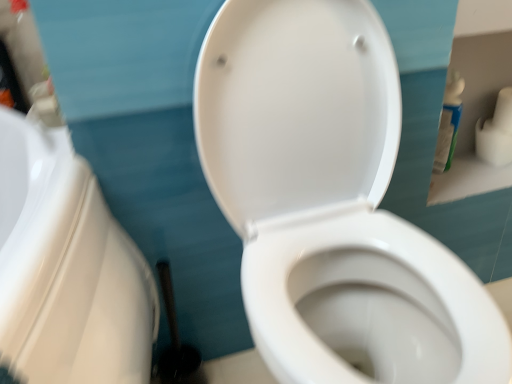
Question: Would you say white plastic bottle at upper right is a long distance from white glossy toilet at center?

Choices:
 (A) yes
 (B) no

Answer: (B)

Question: Does white plastic bottle at upper right have a lesser width compared to white glossy toilet at center?

Choices:
 (A) no
 (B) yes

Answer: (B)

Question: Is white plastic bottle at upper right at the left side of white glossy toilet at center?

Choices:
 (A) no
 (B) yes

Answer: (A)

Question: Is white plastic bottle at upper right oriented away from white glossy toilet at center?

Choices:
 (A) no
 (B) yes

Answer: (A)

Question: Are white plastic bottle at upper right and white glossy toilet at center making contact?

Choices:
 (A) yes
 (B) no

Answer: (B)

Question: Based on their sizes in the image, would you say white glossy toilet at center is bigger or smaller than white matte toilet paper at upper right?

Choices:
 (A) big
 (B) small

Answer: (A)

Question: From a real-world perspective, is white glossy toilet at center positioned above or below white matte toilet paper at upper right?

Choices:
 (A) above
 (B) below

Answer: (B)

Question: From their relative heights in the image, would you say white glossy toilet at center is taller or shorter than white matte toilet paper at upper right?

Choices:
 (A) tall
 (B) short

Answer: (A)

Question: Visually, is white glossy toilet at center positioned to the left or to the right of white matte toilet paper at upper right?

Choices:
 (A) left
 (B) right

Answer: (A)

Question: Choose the correct answer: Is white matte toilet paper at upper right inside white plastic bottle at upper right or outside it?

Choices:
 (A) outside
 (B) inside

Answer: (A)

Question: Considering the positions of point (485, 119) and point (456, 74), is point (485, 119) closer or farther from the camera than point (456, 74)?

Choices:
 (A) closer
 (B) farther

Answer: (B)

Question: In terms of width, does white matte toilet paper at upper right look wider or thinner when compared to white plastic bottle at upper right?

Choices:
 (A) thin
 (B) wide

Answer: (B)

Question: Is white matte toilet paper at upper right to the left or to the right of white plastic bottle at upper right in the image?

Choices:
 (A) right
 (B) left

Answer: (A)

Question: Is white matte toilet paper at upper right in front of or behind white glossy toilet at center in the image?

Choices:
 (A) front
 (B) behind

Answer: (B)

Question: From the image's perspective, is white matte toilet paper at upper right located above or below white glossy toilet at center?

Choices:
 (A) below
 (B) above

Answer: (B)